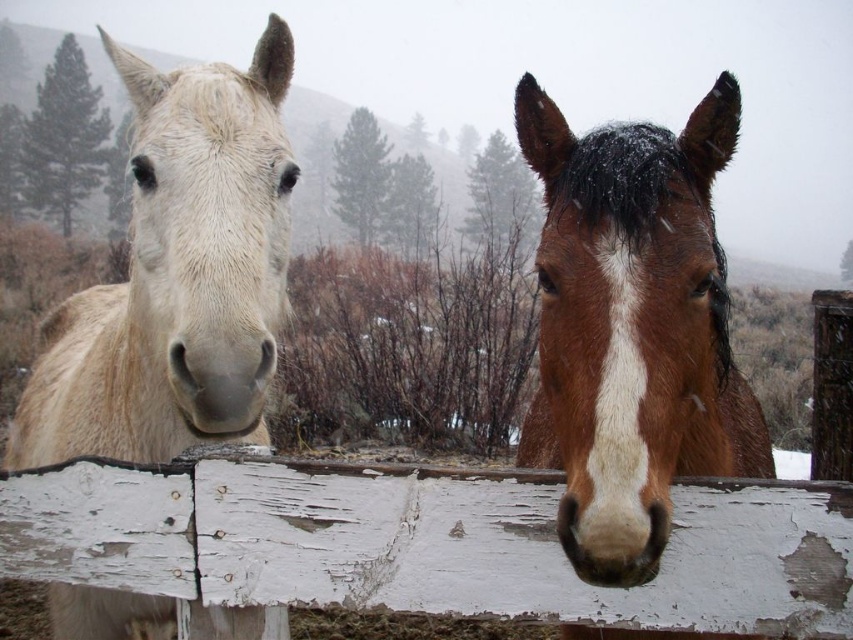
Does point (22, 564) lie behind point (183, 388)?

Yes, it is behind point (183, 388).

Is white peeling wood at center to the right of white matte horse nose at left from the viewer's perspective?

Yes, white peeling wood at center is to the right of white matte horse nose at left.

Which is in front, point (780, 579) or point (248, 390)?

Point (780, 579)

Locate an element on the screen. white peeling wood at center is located at coordinates (428, 544).

Is brown shiny horse at center shorter than white matte horse nose at left?

In fact, brown shiny horse at center may be taller than white matte horse nose at left.

Is point (585, 451) farther from viewer compared to point (242, 355)?

That is False.

Based on the photo, who is more distant from viewer, (590, 202) or (230, 380)?

The point (230, 380) is behind.

Locate an element on the screen. The image size is (853, 640). brown shiny horse at center is located at coordinates (631, 328).

Does white peeling wood at center appear on the left side of light beige fur at left?

No, white peeling wood at center is not to the left of light beige fur at left.

Is point (317, 468) in front of point (190, 195)?

Yes, it is.

Find the location of a particular element. This screenshot has height=640, width=853. white peeling wood at center is located at coordinates (428, 544).